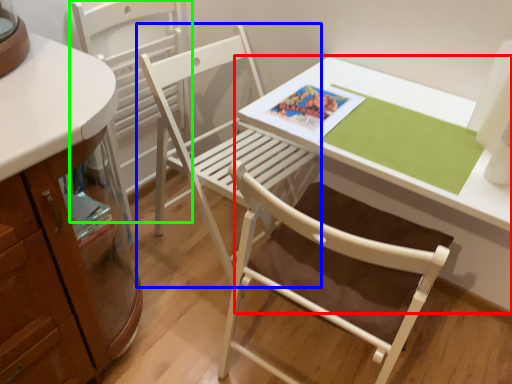
Question: Based on their relative distances, which object is farther from table (highlighted by a red box)? Choose from chair (highlighted by a blue box) and chair (highlighted by a green box).

Choices:
 (A) chair
 (B) chair

Answer: (B)